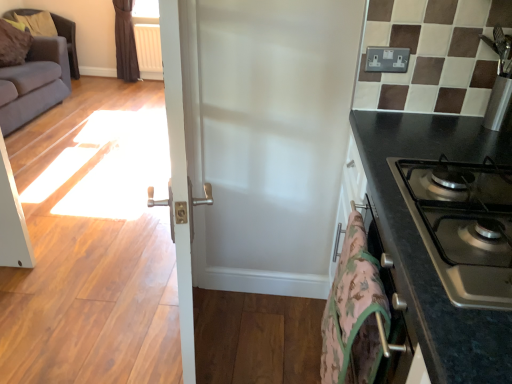
Image resolution: width=512 pixels, height=384 pixels. In order to click on free space in front of white plastic radiator at upper left in this screenshot , I will do `click(146, 87)`.